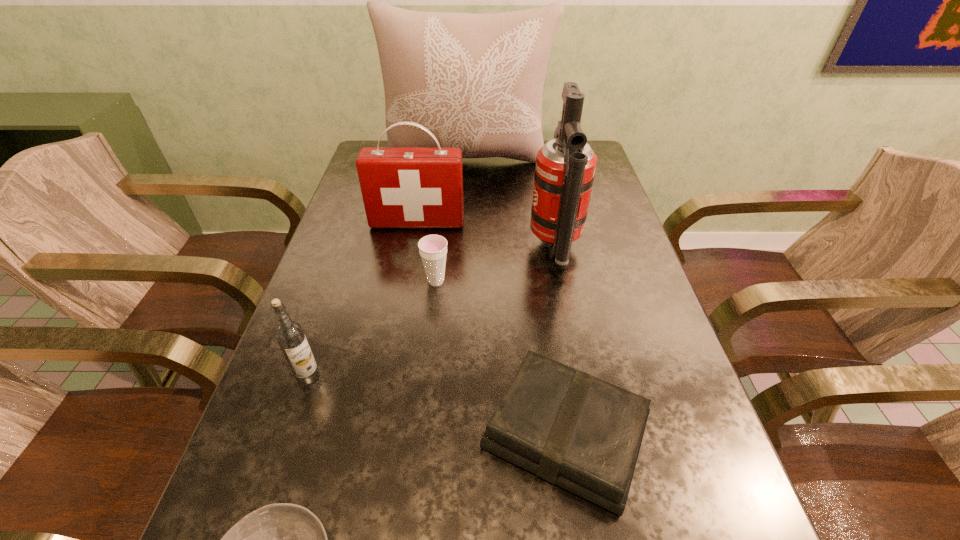
Image resolution: width=960 pixels, height=540 pixels. Find the location of `empty space between the book and the fourth tallest object`. empty space between the book and the fourth tallest object is located at coordinates (437, 404).

Identify which object is the fifth nearest to the tallest object. Please provide its 2D coordinates. Your answer should be formatted as a tuple, i.e. [(x, y)], where the tuple contains the x and y coordinates of a point satisfying the conditions above.

[(566, 426)]

Identify the location of object that stands as the second closest to the fifth shortest object. The image size is (960, 540). point(565,168).

Where is `vacant space that satisfies the following two spatial constraints: 1. on the label of the vodka; 2. on the right side of the book`? This screenshot has height=540, width=960. vacant space that satisfies the following two spatial constraints: 1. on the label of the vodka; 2. on the right side of the book is located at coordinates (289, 433).